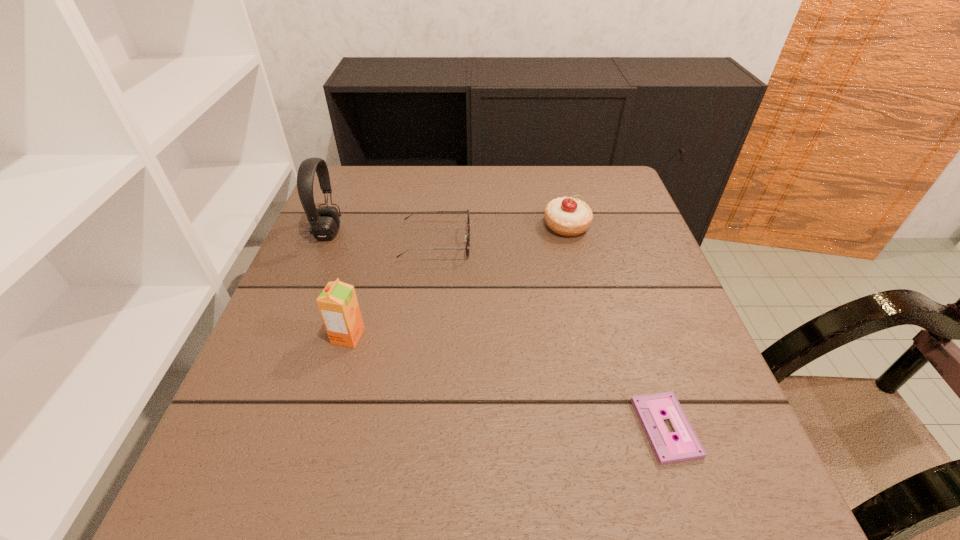
Find the location of a particular element. This screenshot has height=540, width=960. free space that is in between the headset and the second shortest object is located at coordinates (382, 238).

I want to click on vacant region between the leftmost object and the shortest object, so click(x=497, y=330).

Where is `object that ranks as the fourth closest to the shortest object`? The width and height of the screenshot is (960, 540). object that ranks as the fourth closest to the shortest object is located at coordinates (324, 221).

Select which object appears as the second closest to the nearest object. Please provide its 2D coordinates. Your answer should be formatted as a tuple, i.e. [(x, y)], where the tuple contains the x and y coordinates of a point satisfying the conditions above.

[(467, 234)]

This screenshot has height=540, width=960. I want to click on free space that satisfies the following two spatial constraints: 1. on the front-facing side of the leftmost object; 2. on the back side of the fourth object from right to left, so click(x=285, y=336).

Identify the location of free location that satisfies the following two spatial constraints: 1. on the front-facing side of the leftmost object; 2. on the right side of the shortest object. This screenshot has width=960, height=540. (248, 428).

Image resolution: width=960 pixels, height=540 pixels. Identify the location of vacant position in the image that satisfies the following two spatial constraints: 1. on the front-facing side of the leftmost object; 2. on the back side of the fourth object from right to left. (285, 336).

This screenshot has width=960, height=540. I want to click on vacant space that satisfies the following two spatial constraints: 1. through the lenses of the third object from left to right; 2. on the right side of the nearest object, so click(x=414, y=428).

Locate an element on the screen. This screenshot has height=540, width=960. free location that satisfies the following two spatial constraints: 1. through the lenses of the third object from right to left; 2. on the front side of the second object from left to right is located at coordinates (424, 336).